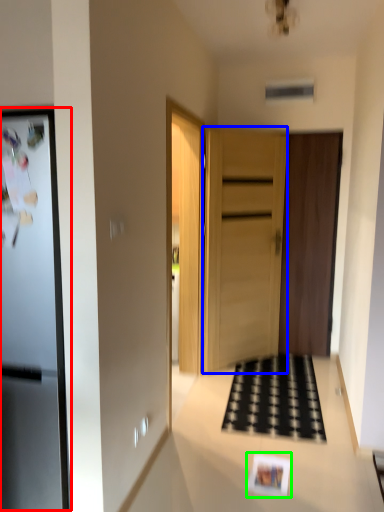
Question: Based on their relative distances, which object is nearer to fridge (highlighted by a red box)? Choose from door (highlighted by a blue box) and postcard (highlighted by a green box).

Choices:
 (A) door
 (B) postcard

Answer: (B)